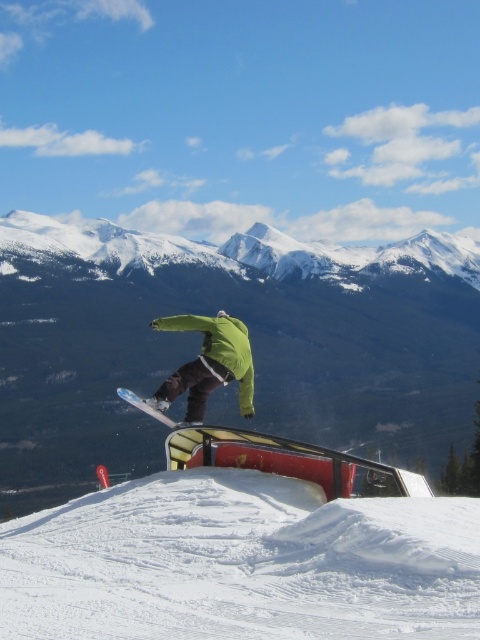
You are a photographer trying to capture the snowboarder and the snow in the scene. Which object, the white fluffy snow at center or the green matte snowboarder at center, is taller?

The white fluffy snow at center is not as tall as the green matte snowboarder at center, so the green matte snowboarder at center is taller.

You are a snowboarder preparing to land on the slope. You see the white fluffy snow at center and the white matte snowboard at center. Which surface should you aim for to ensure a softer landing?

You should aim for the white fluffy snow at center because it is shorter than the white matte snowboard at center, indicating it might be deeper or softer, providing a better cushion for landing.

You are a snowboarder planning to land your trick on the slope. There is a point marked at coordinates (x=240, y=563). What is located at that point?

At point (x=240, y=563) lies white fluffy snow at center, so you can safely land there.